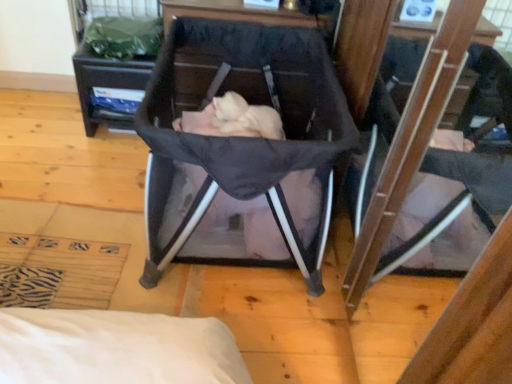
This screenshot has height=384, width=512. What do you see at coordinates (242, 147) in the screenshot?
I see `black mesh crib at center` at bounding box center [242, 147].

Locate an element on the screen. The width and height of the screenshot is (512, 384). black mesh crib at center is located at coordinates (242, 147).

What is the approximate width of black mesh crib at center?

The width of black mesh crib at center is 32.36 inches.

The width and height of the screenshot is (512, 384). Identify the location of black mesh crib at center. (242, 147).